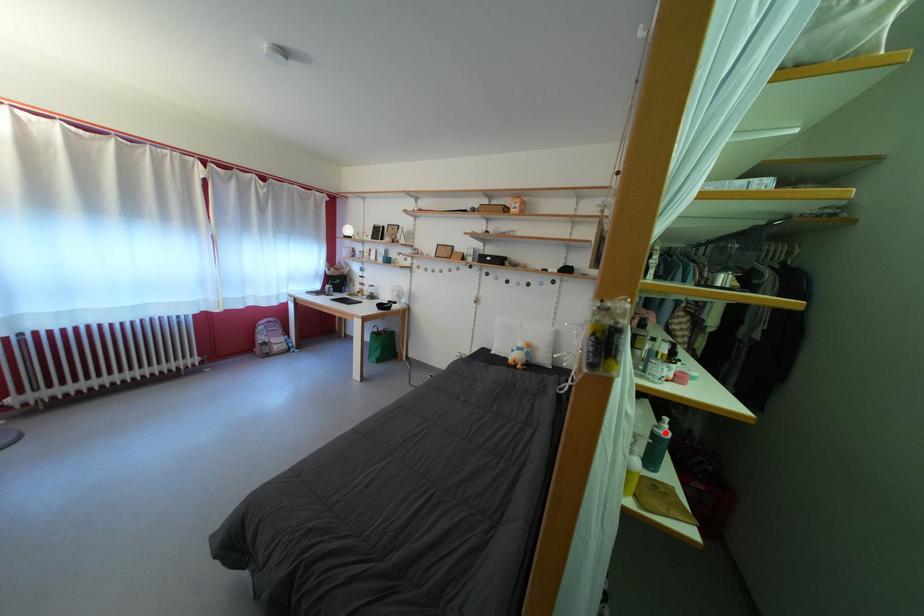
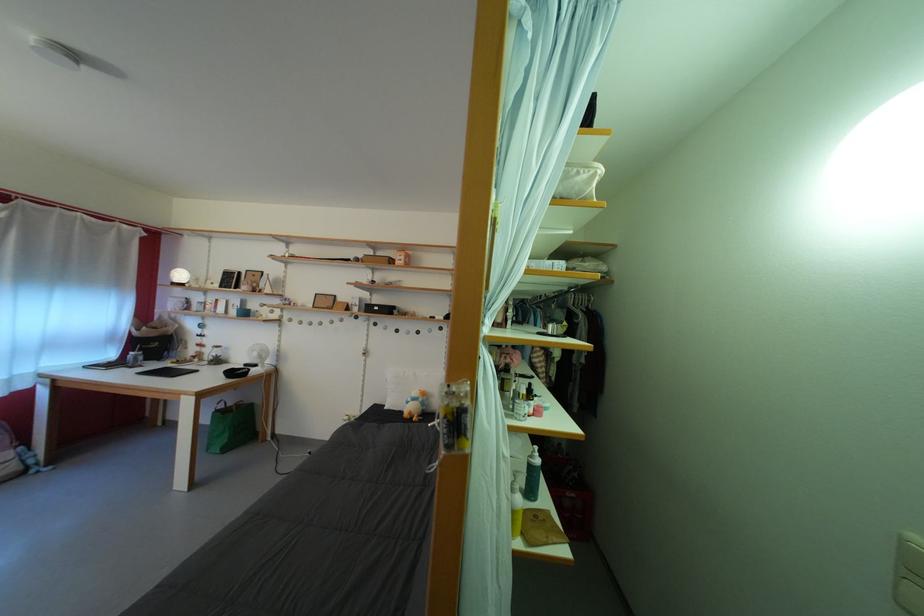
The point at the highlighted location is marked in the first image. Where is the corresponding point in the second image?

(540, 463)